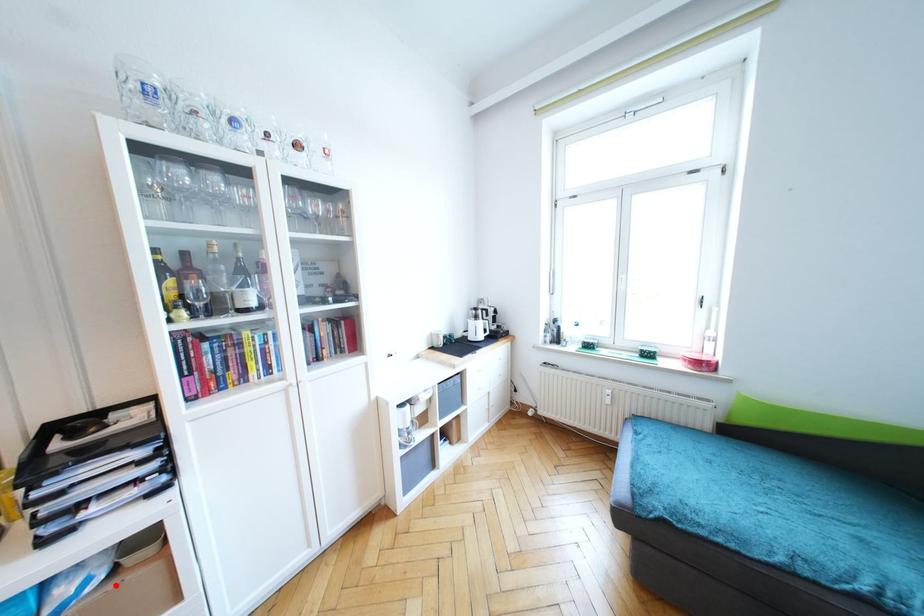
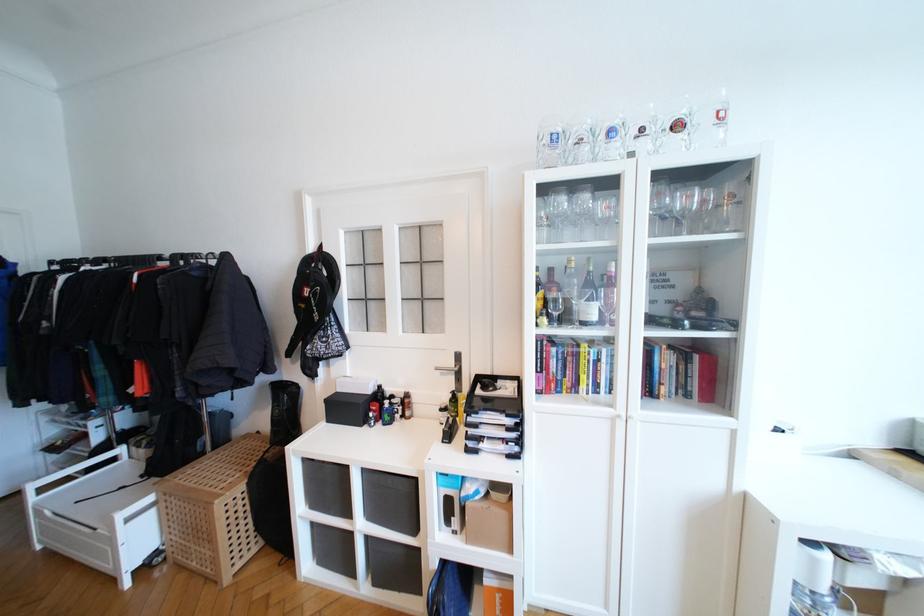
In the second image, find the point that corresponds to the highlighted location in the first image.

(489, 506)